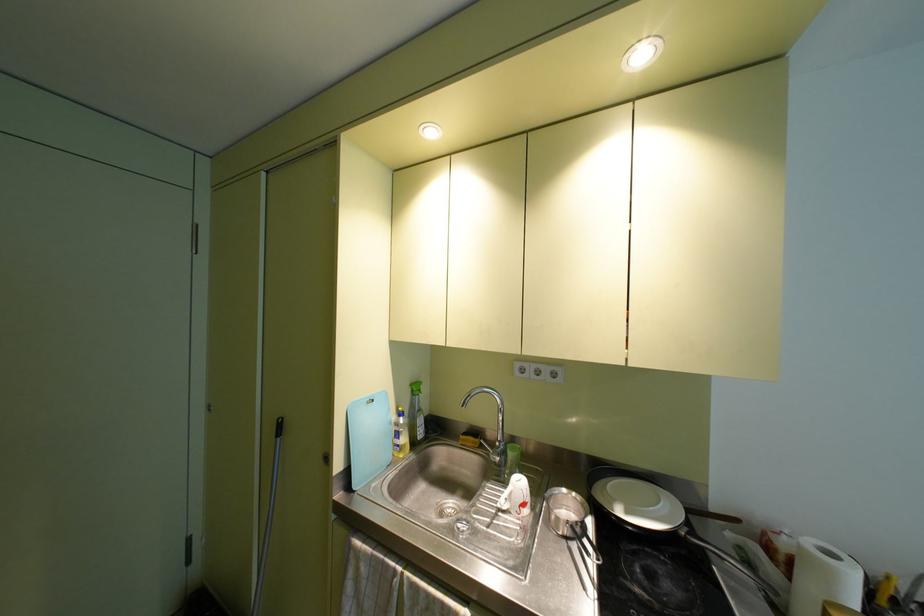
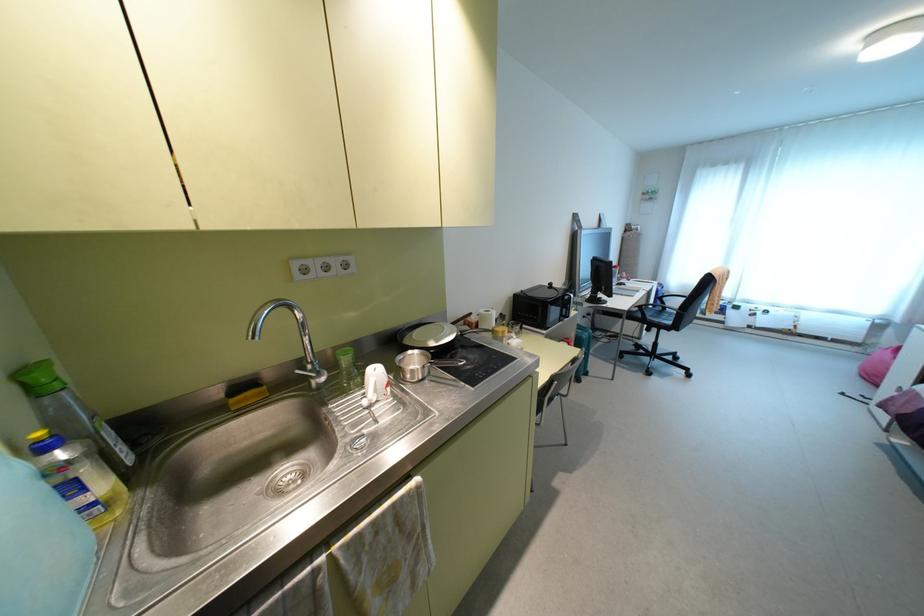
Locate, in the second image, the point that corresponds to point 409,384 in the first image.

(20, 374)